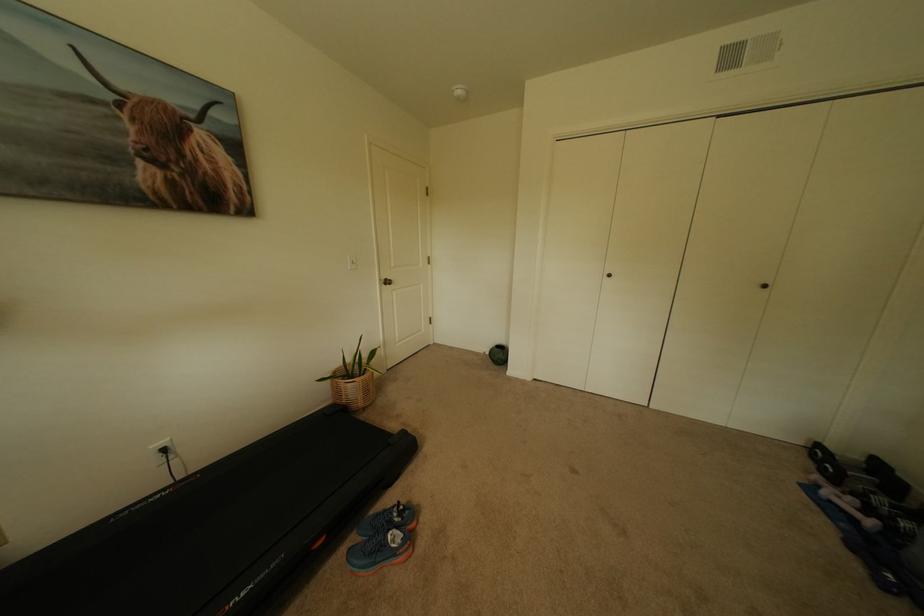
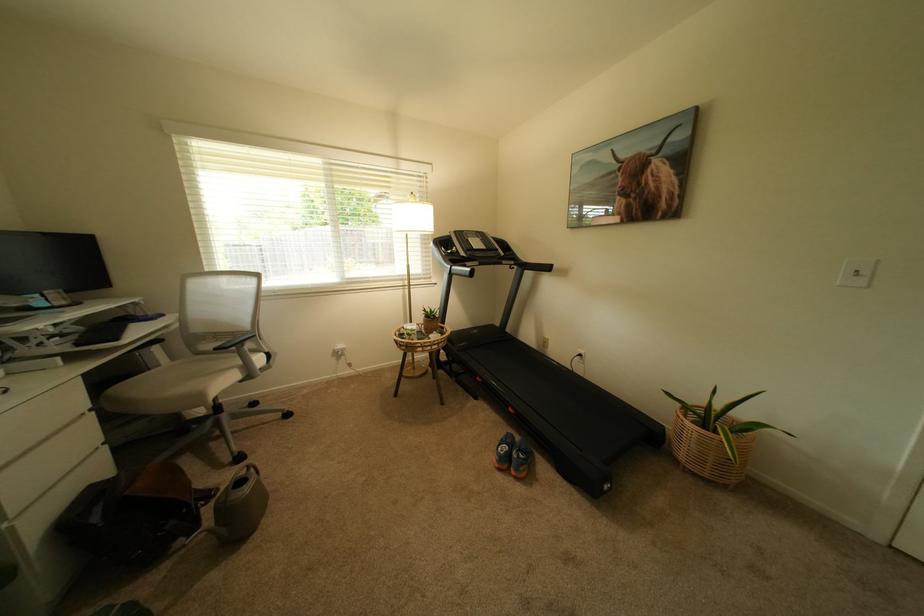
In the second image, find the point that corresponds to the point at 370,395 in the first image.

(695, 448)